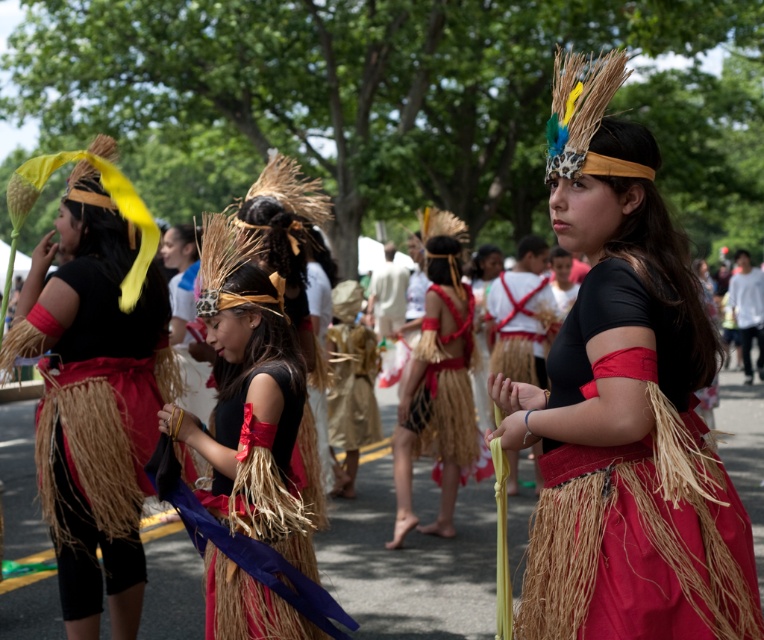
You are a photographer at the event and need to capture both the matte black top at center and the matte straw headdress at left in a single frame. Which object should you focus on first to ensure both are in the frame?

The matte black top at center is thinner than the matte straw headdress at left, so you should focus on the matte straw headdress at left first to ensure both are in the frame.

You are a photographer at the event and want to capture a photo of the matte straw headdress at left and the red woven grass skirt at center. Which object should you focus on first if you want to ensure both are in sharp focus?

The matte straw headdress at left is located above the red woven grass skirt at center, so focusing on the matte straw headdress at left first will help ensure both are in focus since it is closer to the camera.

You are a photographer at this dance event. You want to take a photo that includes both the point at location (x=44, y=458) and the point at (x=442, y=420). Which point should you focus on to ensure both are in sharp focus?

You should focus on the point at (x=442, y=420) because it is farther from the camera than the point at (x=44, y=458). By focusing on the farther point, the depth of field will likely include both points in sharp focus.